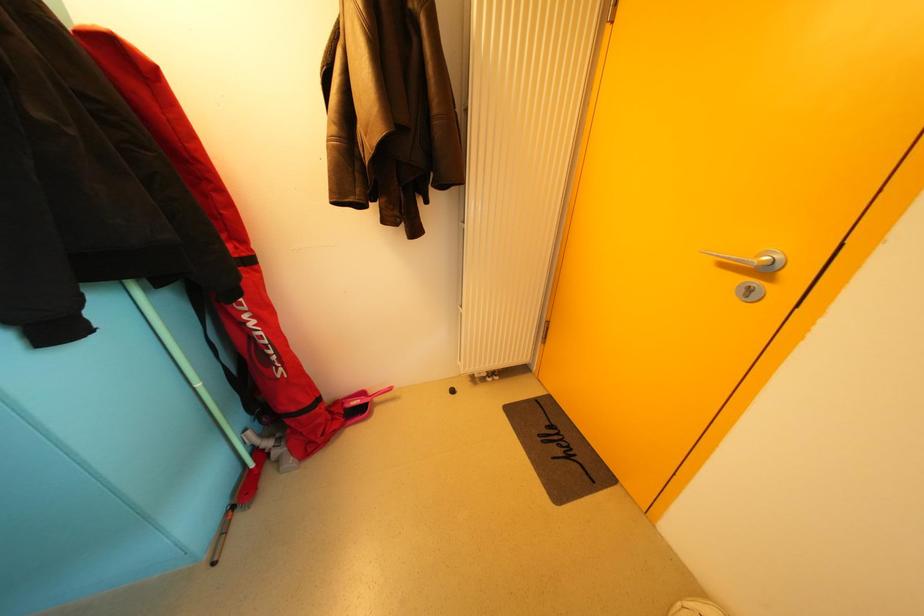
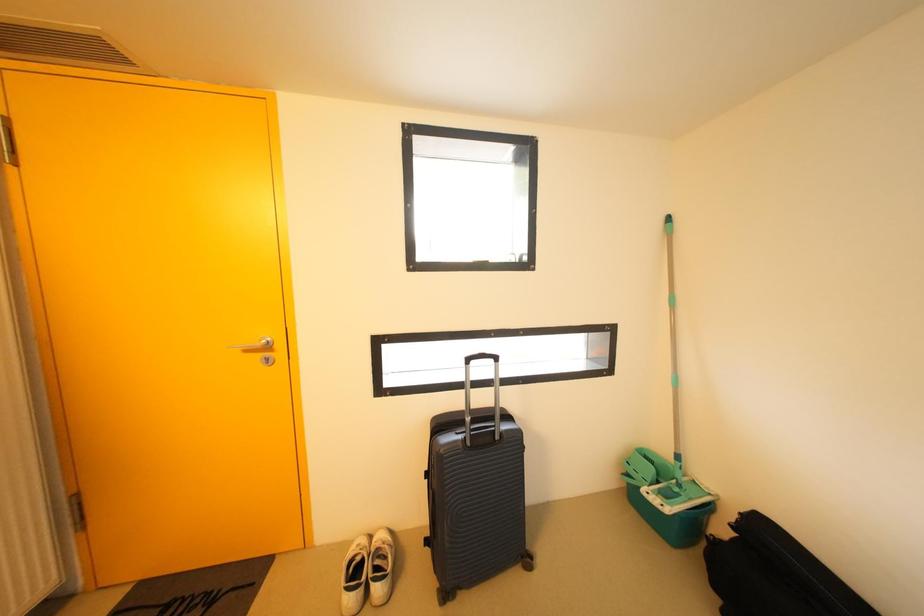
Question: The camera is either moving clockwise (left) or counter-clockwise (right) around the object. The first image is from the beginning of the video and the second image is from the end. Is the camera moving left or right when shooting the video?

Choices:
 (A) Left
 (B) Right

Answer: (A)